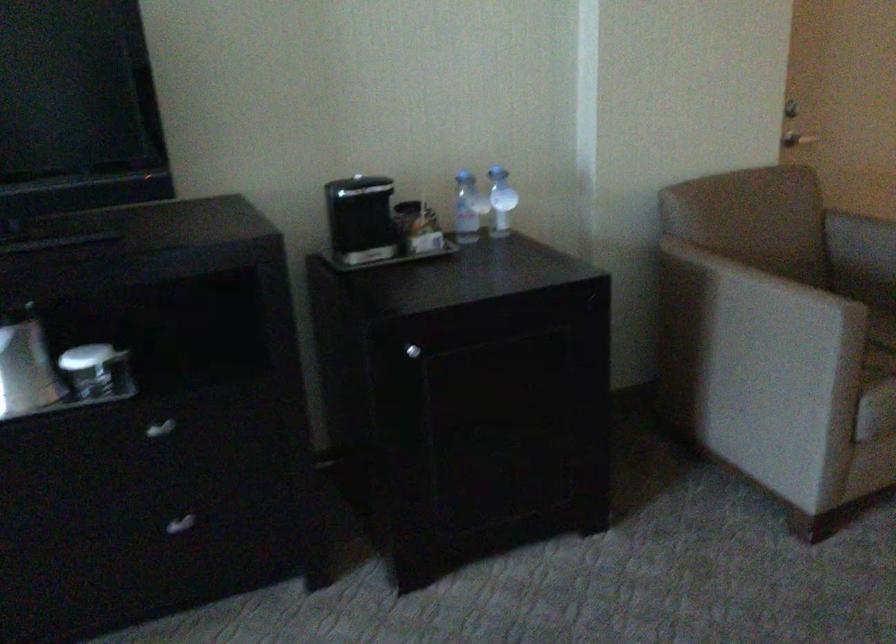
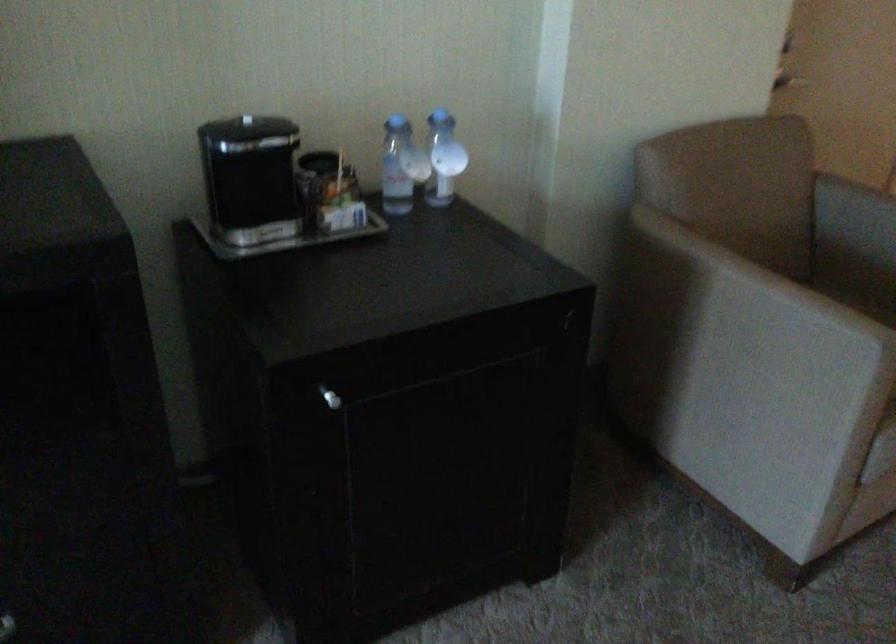
The point at (468, 202) is marked in the first image. Where is the corresponding point in the second image?

(401, 166)